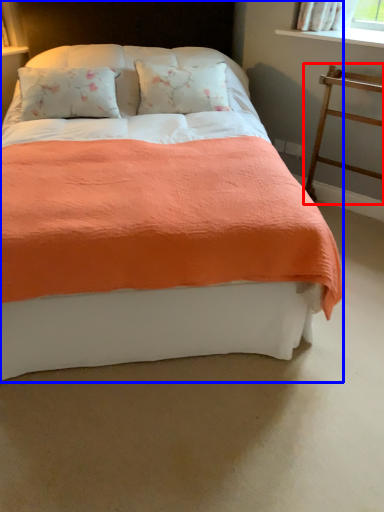
Question: Which object appears farthest to the camera in this image, balustrade (highlighted by a red box) or bed (highlighted by a blue box)?

Choices:
 (A) balustrade
 (B) bed

Answer: (A)